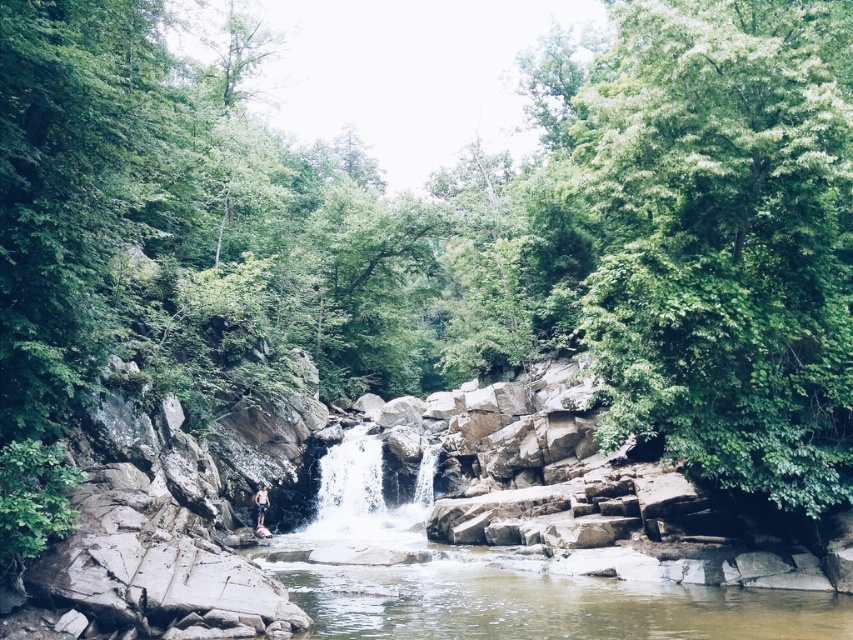
Who is taller, brown rock river at center or tan shorts at center?

Standing taller between the two is brown rock river at center.

In the scene shown: Which is below, brown rock river at center or tan shorts at center?

tan shorts at center

Is point (305, 596) closer to camera compared to point (264, 502)?

Yes, it is.

Identify the location of brown rock river at center. (544, 604).

Is point (416, 604) less distant than point (328, 506)?

Yes, it is.

Image resolution: width=853 pixels, height=640 pixels. Describe the element at coordinates (544, 604) in the screenshot. I see `brown rock river at center` at that location.

This screenshot has width=853, height=640. Find the location of `brown rock river at center`. brown rock river at center is located at coordinates (544, 604).

Is clear water at center taller than tan shorts at center?

Correct, clear water at center is much taller as tan shorts at center.

Is point (357, 442) positioned after point (262, 504)?

Yes, it is behind point (262, 504).

Is point (358, 508) closer to viewer compared to point (256, 509)?

No, (358, 508) is behind (256, 509).

Identify the location of clear water at center. This screenshot has width=853, height=640. (366, 497).